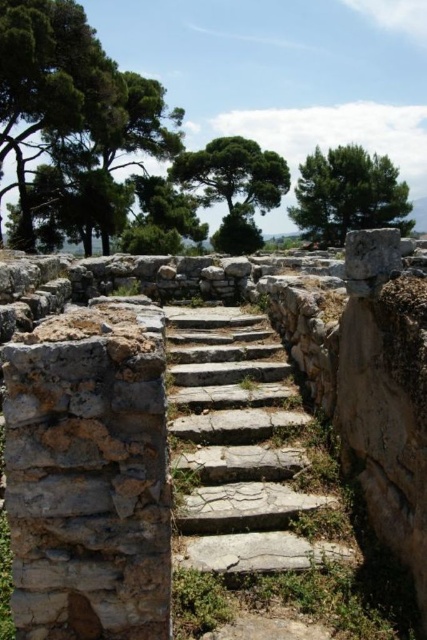
Question: Which object appears closest to the camera in this image?

Choices:
 (A) green leafy tree at upper right
 (B) green leafy tree at upper center

Answer: (A)

Question: Is green leafy tree at upper right positioned before green leafy tree at upper center?

Choices:
 (A) no
 (B) yes

Answer: (B)

Question: Does green leafy tree at upper right lie in front of green leafy tree at upper center?

Choices:
 (A) yes
 (B) no

Answer: (A)

Question: Can you confirm if natural stone stairs at center is positioned below green leafy tree at upper left?

Choices:
 (A) no
 (B) yes

Answer: (B)

Question: Which object is the closest to the green leafy tree at upper left?

Choices:
 (A) green leafy tree at upper right
 (B) natural stone stairs at center
 (C) green leafy tree at upper center

Answer: (C)

Question: Which of the following is the farthest from the observer?

Choices:
 (A) (219, 250)
 (B) (366, 196)
 (C) (233, 362)
 (D) (73, 60)

Answer: (A)